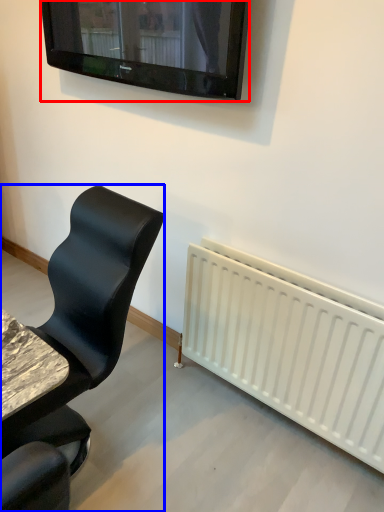
Question: Which point is further to the camera, television (highlighted by a red box) or chair (highlighted by a blue box)?

Choices:
 (A) television
 (B) chair

Answer: (A)